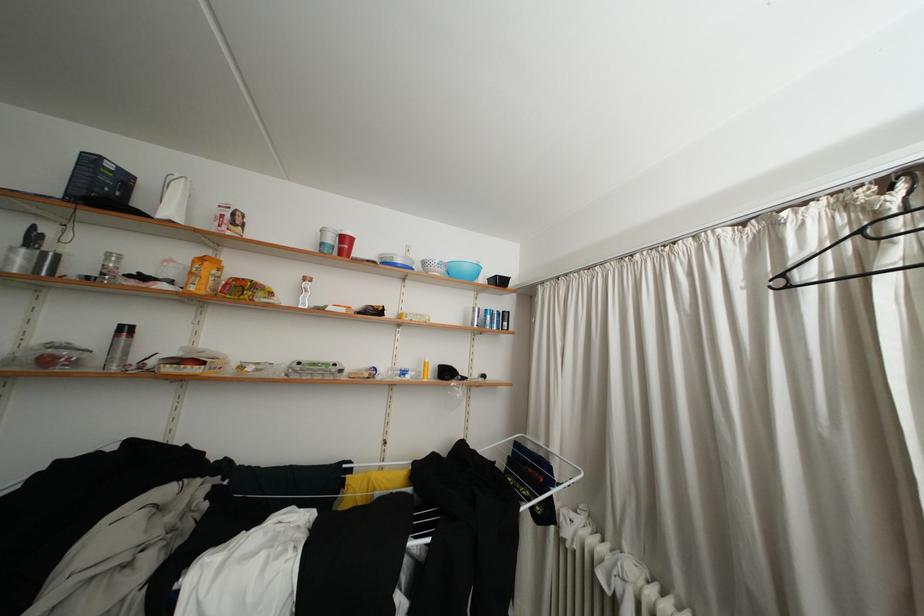
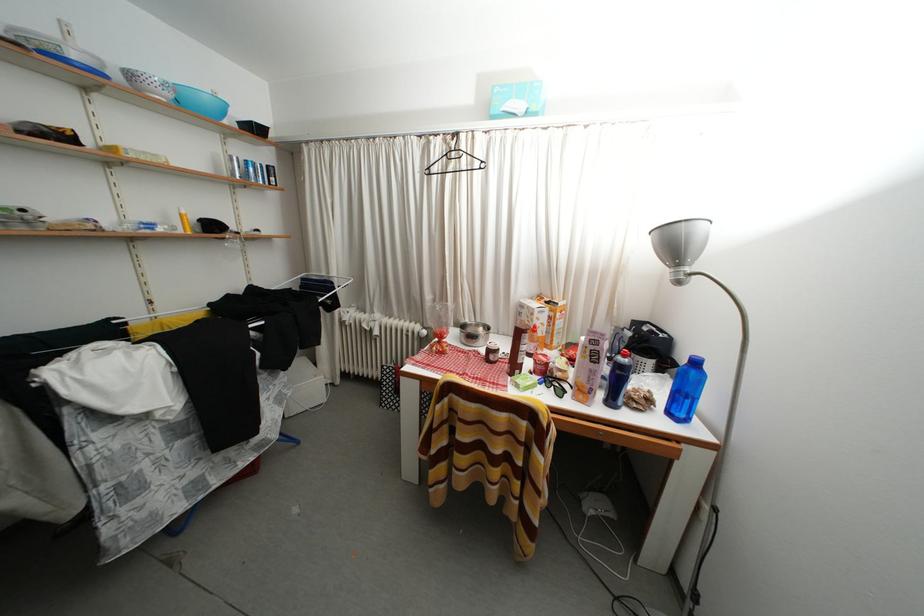
Find the pixel in the second image that matches point 407,265 in the first image.

(81, 61)